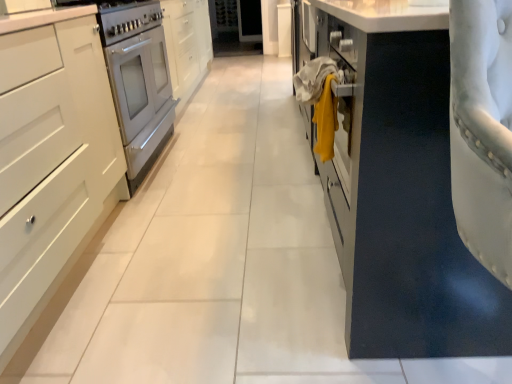
Image resolution: width=512 pixels, height=384 pixels. What do you see at coordinates (398, 185) in the screenshot? I see `suede-like white chair at right, the 1th cabinetry when ordered from right to left` at bounding box center [398, 185].

At what (x,y) coordinates should I click in order to perform the action: click on white glossy oven at left. Please return your answer as a coordinate pair (x, y). This screenshot has height=384, width=512. Looking at the image, I should click on (139, 83).

Considering the sizes of objects yellow fabric at center and suede-like white chair at right, positioned as the second cabinetry in left-to-right order, in the image provided, who is bigger, yellow fabric at center or suede-like white chair at right, positioned as the second cabinetry in left-to-right order,?

Bigger between the two is suede-like white chair at right, positioned as the second cabinetry in left-to-right order.

In the scene shown: Can you see yellow fabric at center touching suede-like white chair at right, positioned as the second cabinetry in left-to-right order?

No, yellow fabric at center is not touching suede-like white chair at right, positioned as the second cabinetry in left-to-right order.

Considering the positions of objects yellow fabric at center and suede-like white chair at right, the 1th cabinetry when ordered from right to left, in the image provided, who is more to the right, yellow fabric at center or suede-like white chair at right, the 1th cabinetry when ordered from right to left,?

suede-like white chair at right, the 1th cabinetry when ordered from right to left.

Who is more distant, white glossy oven at left or white matte cabinet at left, the second cabinetry viewed from the right?

Positioned behind is white glossy oven at left.

Measure the distance from white glossy oven at left to white matte cabinet at left, which is the 1th cabinetry in left-to-right order.

white glossy oven at left is 18.31 inches away from white matte cabinet at left, which is the 1th cabinetry in left-to-right order.

Would you say white glossy oven at left is a long distance from white matte cabinet at left, the second cabinetry viewed from the right?

Actually, white glossy oven at left and white matte cabinet at left, the second cabinetry viewed from the right, are a little close together.

Consider the image. Can you confirm if white glossy oven at left is smaller than white matte cabinet at left, which is the 1th cabinetry in left-to-right order?

Yes, white glossy oven at left is smaller than white matte cabinet at left, which is the 1th cabinetry in left-to-right order.

Is white matte cabinet at left, which is the 1th cabinetry in left-to-right order, turned away from white glossy oven at left?

No, white matte cabinet at left, which is the 1th cabinetry in left-to-right order,'s orientation is not away from white glossy oven at left.

Which object is positioned more to the left, white matte cabinet at left, which is the 1th cabinetry in left-to-right order, or white glossy oven at left?

white matte cabinet at left, which is the 1th cabinetry in left-to-right order.

Can you tell me how much white matte cabinet at left, the second cabinetry viewed from the right, and white glossy oven at left differ in facing direction?

They differ by 2.18e-05 degrees in their facing directions.

From a real-world perspective, which object rests below the other?

From a 3D spatial view, white glossy oven at left is below.

Which is in front, point (316, 72) or point (149, 76)?

The point (316, 72) is closer to the camera.

Which of these two, yellow fabric at center or white glossy oven at left, is bigger?

white glossy oven at left is bigger.

Is yellow fabric at center facing away from white glossy oven at left?

No, yellow fabric at center is not facing away from white glossy oven at left.

Considering the sizes of objects yellow fabric at center and white glossy oven at left in the image provided, who is shorter, yellow fabric at center or white glossy oven at left?

→ yellow fabric at center is shorter.

Identify the location of laundry positioned vertically above the white matte cabinet at left, the second cabinetry viewed from the right (from a real-world perspective). click(320, 100).

Can you confirm if white matte cabinet at left, which is the 1th cabinetry in left-to-right order, is shorter than yellow fabric at center?

In fact, white matte cabinet at left, which is the 1th cabinetry in left-to-right order, may be taller than yellow fabric at center.

Is the depth of white matte cabinet at left, the second cabinetry viewed from the right, less than that of yellow fabric at center?

Yes, it is in front of yellow fabric at center.

How distant is white matte cabinet at left, which is the 1th cabinetry in left-to-right order, from yellow fabric at center?

34.58 inches.

From the picture: Is white matte cabinet at left, which is the 1th cabinetry in left-to-right order, in front of or behind suede-like white chair at right, the 1th cabinetry when ordered from right to left, in the image?

white matte cabinet at left, which is the 1th cabinetry in left-to-right order, is behind suede-like white chair at right, the 1th cabinetry when ordered from right to left.

Considering the sizes of objects white matte cabinet at left, which is the 1th cabinetry in left-to-right order, and suede-like white chair at right, the 1th cabinetry when ordered from right to left, in the image provided, who is bigger, white matte cabinet at left, which is the 1th cabinetry in left-to-right order, or suede-like white chair at right, the 1th cabinetry when ordered from right to left,?

white matte cabinet at left, which is the 1th cabinetry in left-to-right order.

Can you tell me how much white matte cabinet at left, the second cabinetry viewed from the right, and suede-like white chair at right, the 1th cabinetry when ordered from right to left, differ in facing direction?

white matte cabinet at left, the second cabinetry viewed from the right, and suede-like white chair at right, the 1th cabinetry when ordered from right to left, are facing 74.6 degrees away from each other.

From a real-world perspective, which is physically below, white matte cabinet at left, the second cabinetry viewed from the right, or suede-like white chair at right, positioned as the second cabinetry in left-to-right order?

white matte cabinet at left, the second cabinetry viewed from the right.

Considering the sizes of objects white glossy oven at left and suede-like white chair at right, positioned as the second cabinetry in left-to-right order, in the image provided, who is thinner, white glossy oven at left or suede-like white chair at right, positioned as the second cabinetry in left-to-right order,?

suede-like white chair at right, positioned as the second cabinetry in left-to-right order.

Based on the photo, is white glossy oven at left facing towards suede-like white chair at right, the 1th cabinetry when ordered from right to left?

No, white glossy oven at left is not turned towards suede-like white chair at right, the 1th cabinetry when ordered from right to left.

Are white glossy oven at left and suede-like white chair at right, the 1th cabinetry when ordered from right to left, located far from each other?

white glossy oven at left is positioned a significant distance from suede-like white chair at right, the 1th cabinetry when ordered from right to left.

Where is `laundry that is above the suede-like white chair at right, positioned as the second cabinetry in left-to-right order (from the image's perspective)`? laundry that is above the suede-like white chair at right, positioned as the second cabinetry in left-to-right order (from the image's perspective) is located at coordinates (320, 100).

Find the location of a particular element. The image size is (512, 384). the 1st cabinetry directly above the white glossy oven at left (from a real-world perspective) is located at coordinates (54, 146).

Based on their spatial positions, is white matte cabinet at left, which is the 1th cabinetry in left-to-right order, or suede-like white chair at right, the 1th cabinetry when ordered from right to left, further from white glossy oven at left?

suede-like white chair at right, the 1th cabinetry when ordered from right to left, is further to white glossy oven at left.

Considering their positions, is white glossy oven at left positioned further to yellow fabric at center than white matte cabinet at left, the second cabinetry viewed from the right?

white glossy oven at left is further to yellow fabric at center.

From the image, which object appears to be nearer to white glossy oven at left, white matte cabinet at left, the second cabinetry viewed from the right, or yellow fabric at center?

The object closer to white glossy oven at left is white matte cabinet at left, the second cabinetry viewed from the right.

Considering their positions, is white glossy oven at left positioned closer to suede-like white chair at right, the 1th cabinetry when ordered from right to left, than white matte cabinet at left, the second cabinetry viewed from the right?

white matte cabinet at left, the second cabinetry viewed from the right, is closer to suede-like white chair at right, the 1th cabinetry when ordered from right to left.

When comparing their distances from white glossy oven at left, does suede-like white chair at right, positioned as the second cabinetry in left-to-right order, or yellow fabric at center seem closer?

Among the two, yellow fabric at center is located nearer to white glossy oven at left.

Based on their spatial positions, is suede-like white chair at right, positioned as the second cabinetry in left-to-right order, or yellow fabric at center further from white matte cabinet at left, which is the 1th cabinetry in left-to-right order?

suede-like white chair at right, positioned as the second cabinetry in left-to-right order, lies further to white matte cabinet at left, which is the 1th cabinetry in left-to-right order, than the other object.

When comparing their distances from suede-like white chair at right, positioned as the second cabinetry in left-to-right order, does white glossy oven at left or yellow fabric at center seem further?

white glossy oven at left.

Consider the image. From the image, which object appears to be farther from white matte cabinet at left, which is the 1th cabinetry in left-to-right order, yellow fabric at center or white glossy oven at left?

Based on the image, yellow fabric at center appears to be further to white matte cabinet at left, which is the 1th cabinetry in left-to-right order.

This screenshot has height=384, width=512. I want to click on laundry between white matte cabinet at left, the second cabinetry viewed from the right, and white glossy oven at left from front to back, so click(x=320, y=100).

Find the location of `laundry between white matte cabinet at left, the second cabinetry viewed from the right, and suede-like white chair at right, the 1th cabinetry when ordered from right to left, in the horizontal direction`. laundry between white matte cabinet at left, the second cabinetry viewed from the right, and suede-like white chair at right, the 1th cabinetry when ordered from right to left, in the horizontal direction is located at coordinates (320, 100).

Find the location of a particular element. The height and width of the screenshot is (384, 512). cabinetry between suede-like white chair at right, positioned as the second cabinetry in left-to-right order, and white glossy oven at left, along the z-axis is located at coordinates (54, 146).

This screenshot has width=512, height=384. Find the location of `laundry between suede-like white chair at right, positioned as the second cabinetry in left-to-right order, and white glossy oven at left, along the z-axis`. laundry between suede-like white chair at right, positioned as the second cabinetry in left-to-right order, and white glossy oven at left, along the z-axis is located at coordinates (320, 100).